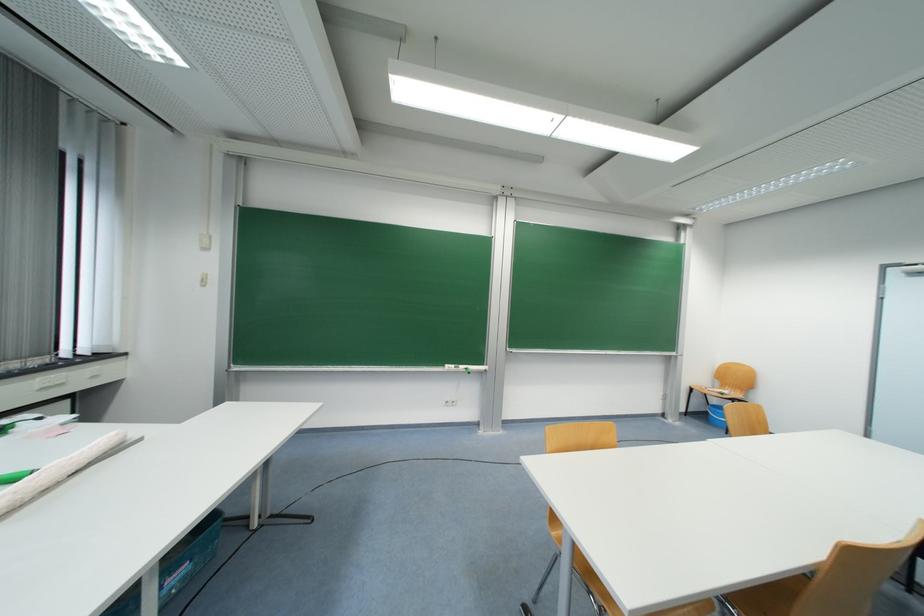
Describe the element at coordinates (898, 377) in the screenshot. The height and width of the screenshot is (616, 924). I see `the metal door handle` at that location.